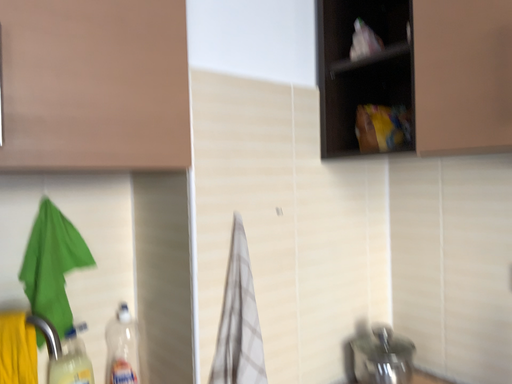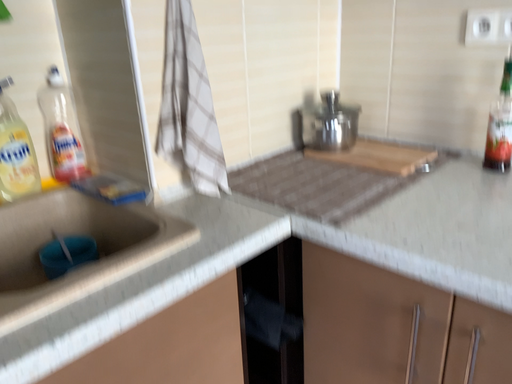
Question: Which way did the camera rotate in the video?

Choices:
 (A) rotated right
 (B) rotated left

Answer: (A)